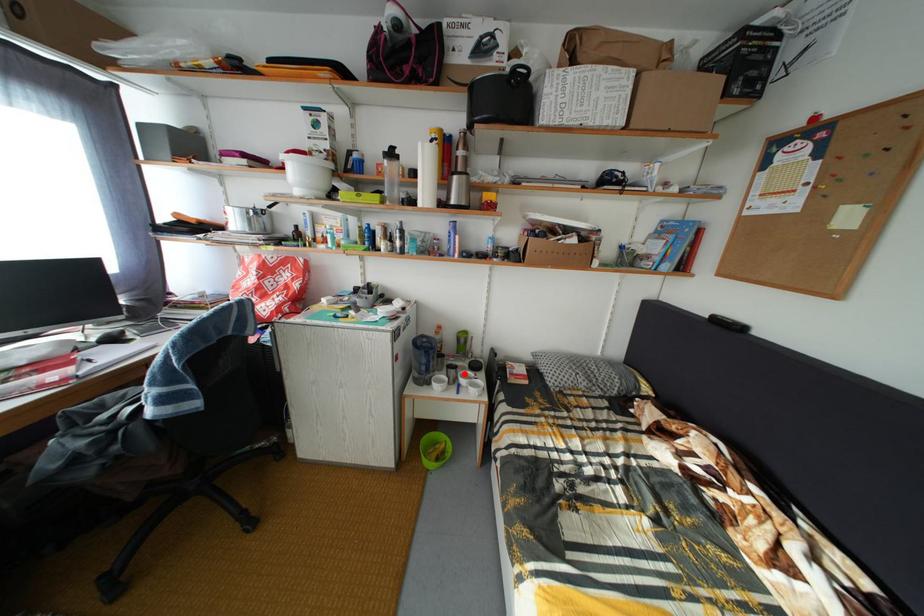
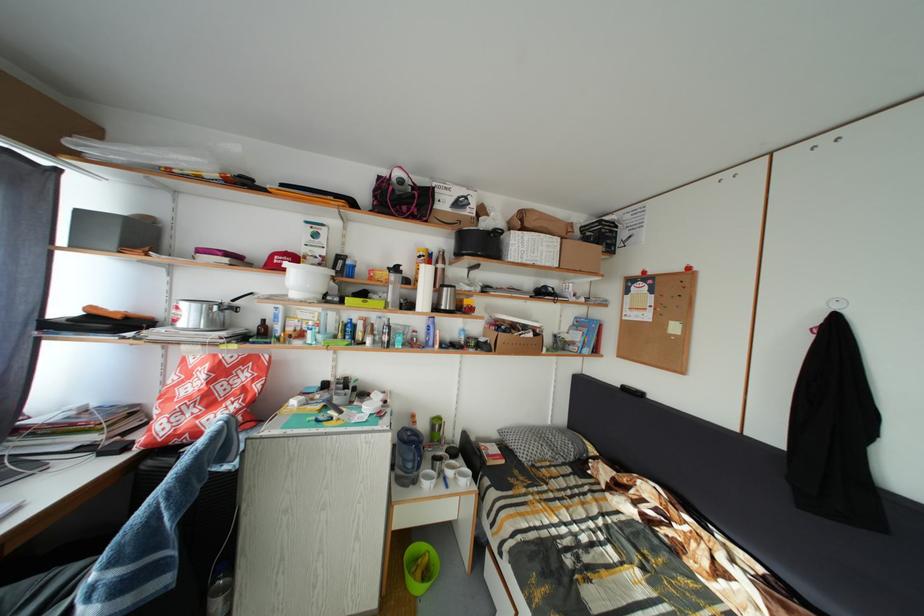
Find the pixel in the second image that matches the highlighted location in the first image.

(450, 464)